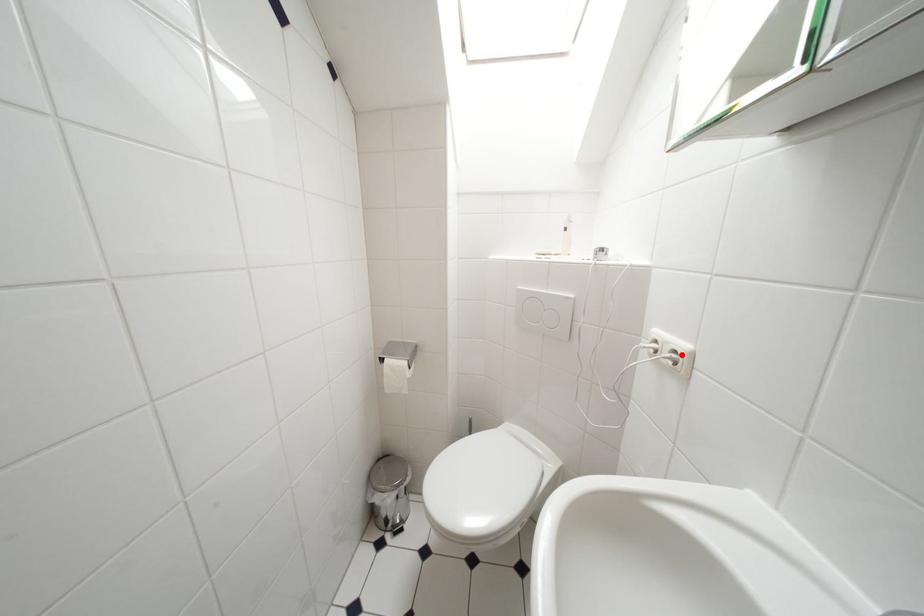
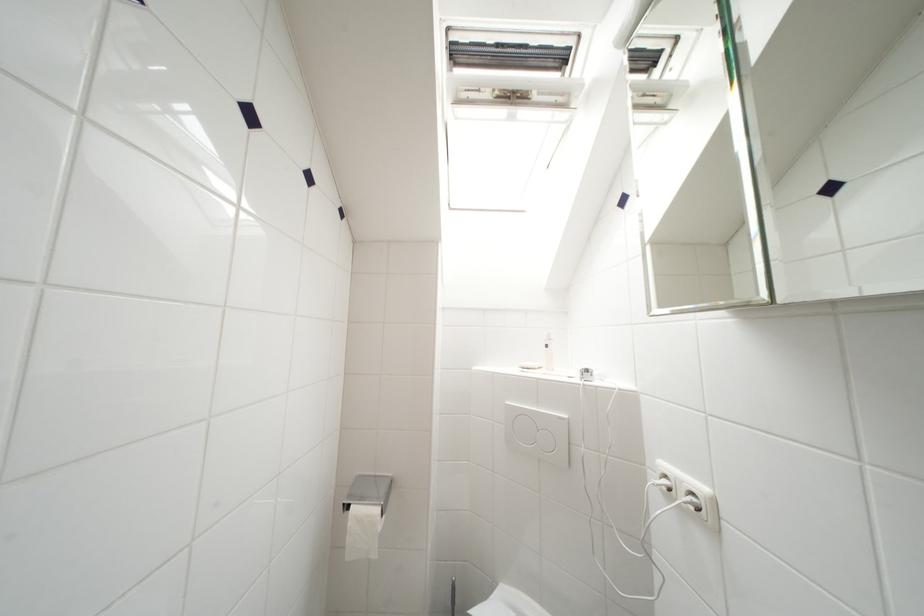
Locate, in the second image, the point that corresponds to the highlighted location in the first image.

(699, 498)